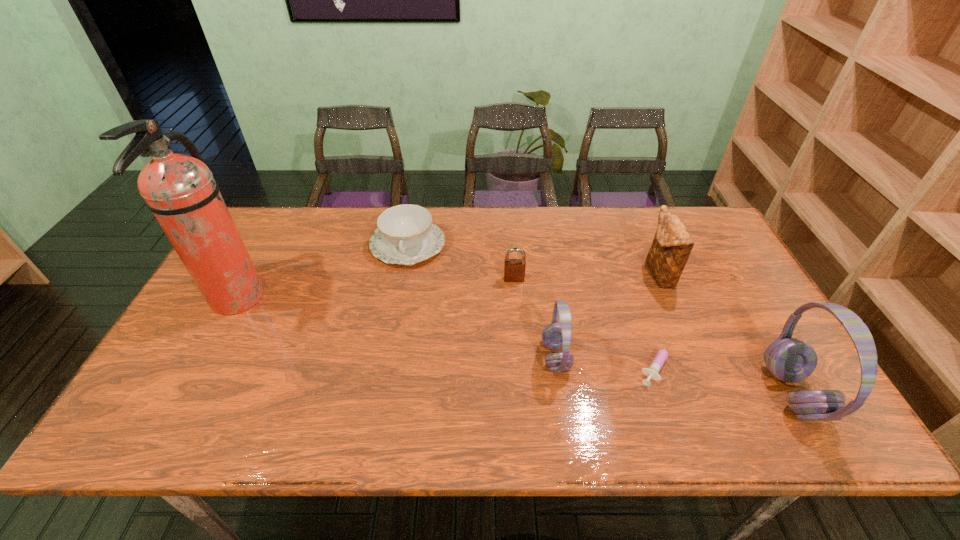
Where is `vacant space located 0.220m at the nozzle of the fire extinguisher`? This screenshot has height=540, width=960. vacant space located 0.220m at the nozzle of the fire extinguisher is located at coordinates (341, 299).

Where is `blank space located 0.300m on the back of the shortest object`? This screenshot has width=960, height=540. blank space located 0.300m on the back of the shortest object is located at coordinates (623, 261).

At what (x,y) coordinates should I click in order to perform the action: click on object positioned at the far edge. Please return your answer as a coordinate pair (x, y). The width and height of the screenshot is (960, 540). Looking at the image, I should click on (406, 235).

I want to click on syringe present at the near edge, so click(x=652, y=371).

Identify the location of object that is at the left edge. [180, 190].

Locate an element on the screen. The width and height of the screenshot is (960, 540). object at the right edge is located at coordinates (791, 360).

Identify the location of object located in the near right corner section of the desktop. Image resolution: width=960 pixels, height=540 pixels. (791, 360).

Identify the location of vacant space at the far edge of the desktop. This screenshot has width=960, height=540. (557, 231).

Where is `vacant space at the near edge`? This screenshot has height=540, width=960. vacant space at the near edge is located at coordinates (421, 389).

Identify the location of free location at the right edge of the desktop. (763, 323).